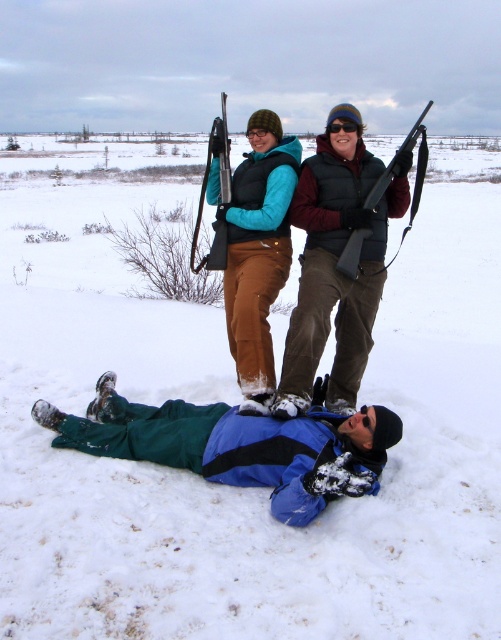
You are a photographer trying to capture a group photo of the blue fleece jacket at lower center and the matte black vest at upper center. Since you want both subjects to be in focus, you need to know their vertical positions. Based on the scene, which one is lower in the image?

The blue fleece jacket at lower center is positioned under matte black vest at upper center, so the blue fleece jacket at lower center is lower in the image.

You are standing at the origin point in this snowy scene. There are two points marked in the image. Which of the two points, point (x=224, y=275) or point (x=350, y=129), is farther away from you?

Point (x=224, y=275) is behind point (x=350, y=129), so it is farther away from you.